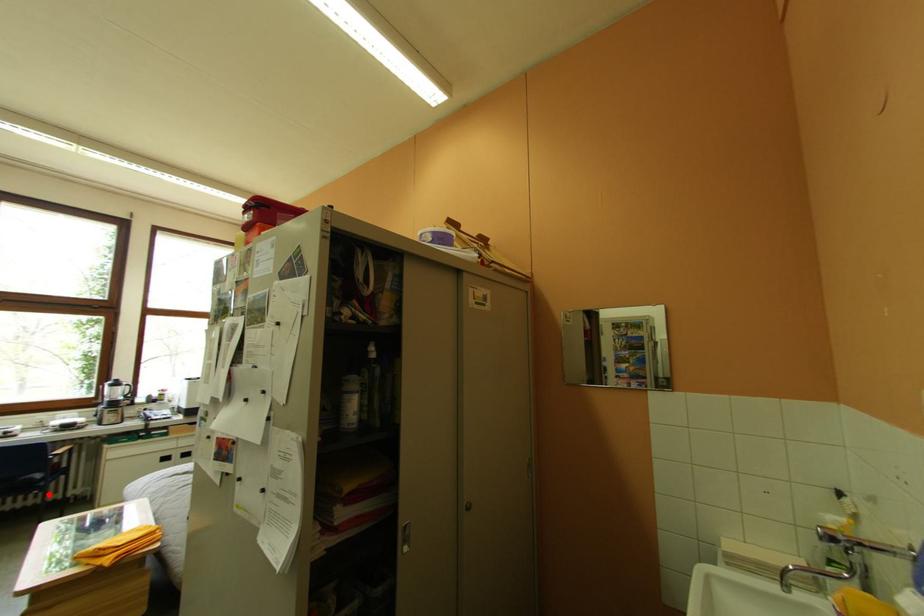
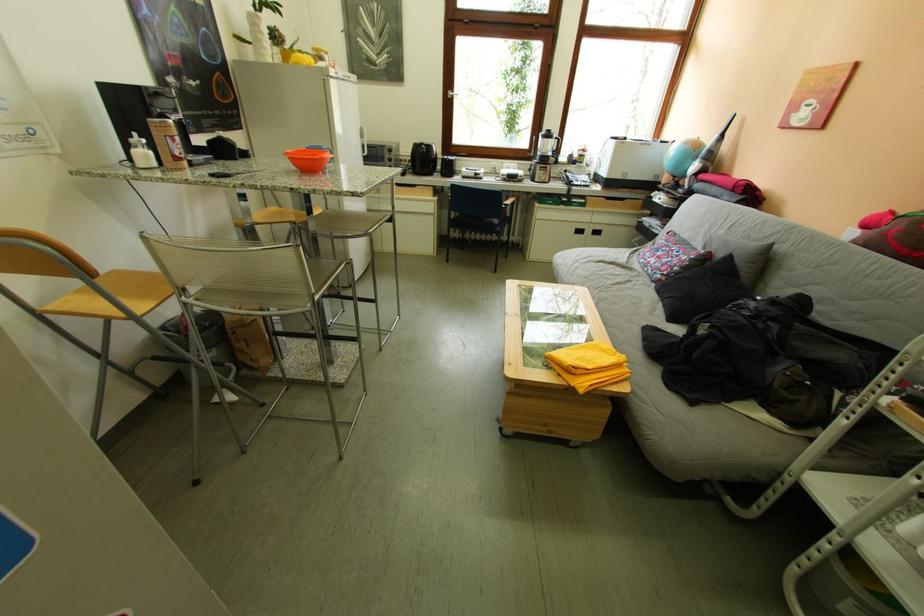
Question: A red point is marked in image1. In image2, is the corresponding 3D point closer to the camera or farther? Reply with the corresponding letter.

Choices:
 (A) The corresponding 3D point is closer.
 (B) The corresponding 3D point is farther.

Answer: (A)